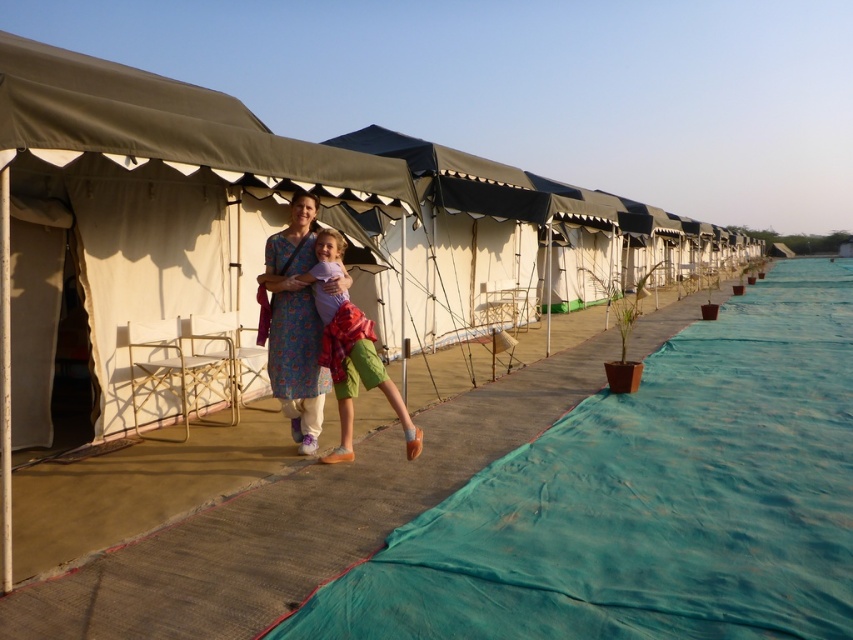
You are a photographer trying to capture a photo of the floral fabric dress at center and the matte purple shirt at center. Since you want to focus on the taller object, which one should you adjust your camera angle to focus on?

The floral fabric dress at center is taller than the matte purple shirt at center, so you should adjust your camera angle to focus on the floral fabric dress at center.

You are planning to set up a temporary ramp for accessibility between two tents. You have a teal fabric ramp at center and a floral fabric dress at center. Which object is more suitable for the ramp due to its size?

The teal fabric ramp at center is more suitable for the ramp because it has a larger size compared to the floral fabric dress at center.